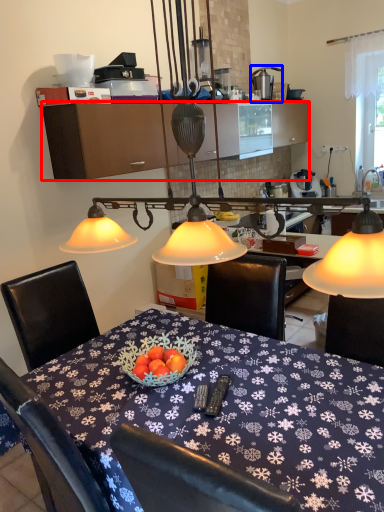
Question: Among these objects, which one is farthest to the camera, cabinetry (highlighted by a red box) or tableware (highlighted by a blue box)?

Choices:
 (A) cabinetry
 (B) tableware

Answer: (B)